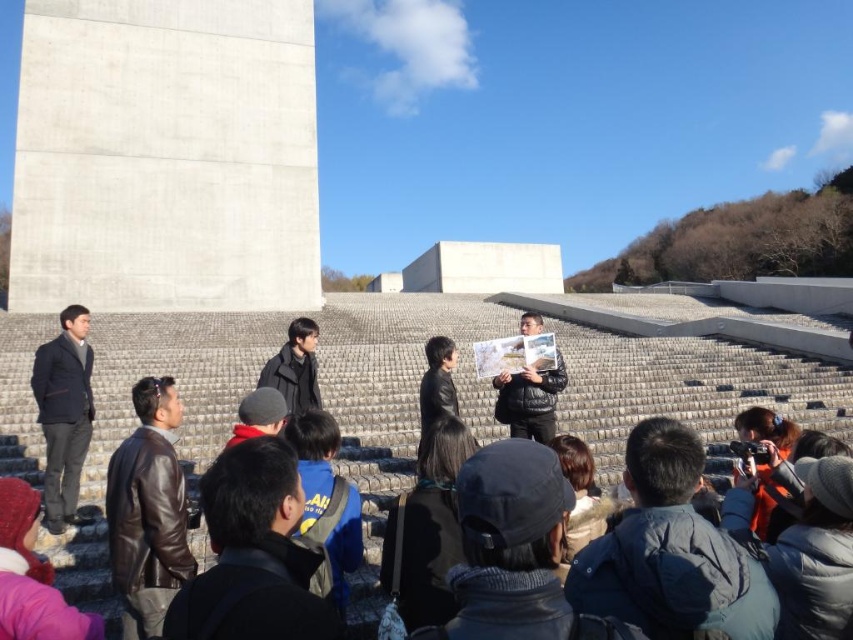
Question: Among these objects, which one is farthest from the camera?

Choices:
 (A) dark brown leather jacket at center
 (B) black leather backpack at center
 (C) dark blue jacket at lower right

Answer: (B)

Question: Is black leather hat at center to the left of blue fabric jacket at center from the viewer's perspective?

Choices:
 (A) no
 (B) yes

Answer: (A)

Question: Which object appears farthest from the camera in this image?

Choices:
 (A) blue fabric jacket at center
 (B) leather jacket at lower center
 (C) brown leather jacket at lower left
 (D) black leather hat at center

Answer: (C)

Question: Can you confirm if orange fabric camera at lower right is wider than dark brown leather jacket at center?

Choices:
 (A) yes
 (B) no

Answer: (A)

Question: Is black leather hat at center above orange fabric camera at lower right?

Choices:
 (A) yes
 (B) no

Answer: (B)

Question: Which point appears closest to the camera in this image?

Choices:
 (A) (502, 419)
 (B) (322, 413)
 (C) (86, 627)
 (D) (271, 582)

Answer: (D)